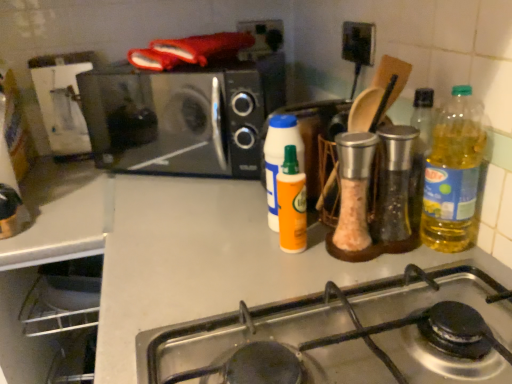
Question: From a real-world perspective, is yellow translucent bottle at right, the 1th bottle from the right, over stainless steel gas stove at lower center?

Choices:
 (A) no
 (B) yes

Answer: (B)

Question: Considering the relative sizes of yellow translucent bottle at right, placed as the fourth bottle when sorted from left to right, and stainless steel gas stove at lower center in the image provided, is yellow translucent bottle at right, placed as the fourth bottle when sorted from left to right, thinner than stainless steel gas stove at lower center?

Choices:
 (A) yes
 (B) no

Answer: (A)

Question: Does yellow translucent bottle at right, the 1th bottle from the right, have a smaller size compared to stainless steel gas stove at lower center?

Choices:
 (A) no
 (B) yes

Answer: (B)

Question: Does yellow translucent bottle at right, placed as the fourth bottle when sorted from left to right, turn towards stainless steel gas stove at lower center?

Choices:
 (A) no
 (B) yes

Answer: (A)

Question: Does yellow translucent bottle at right, the 1th bottle from the right, contain stainless steel gas stove at lower center?

Choices:
 (A) yes
 (B) no

Answer: (B)

Question: From the image's perspective, relative to yellow translucent bottle at right, placed as the fourth bottle when sorted from left to right, is orange matte bottle at center, which appears as the 4th bottle when viewed from the right, above or below?

Choices:
 (A) above
 (B) below

Answer: (A)

Question: Is point (274, 158) positioned closer to the camera than point (464, 107)?

Choices:
 (A) farther
 (B) closer

Answer: (A)

Question: Visually, is orange matte bottle at center, which is the first bottle in left-to-right order, positioned to the left or to the right of yellow translucent bottle at right, placed as the fourth bottle when sorted from left to right?

Choices:
 (A) right
 (B) left

Answer: (B)

Question: Do you think orange matte bottle at center, which appears as the 4th bottle when viewed from the right, is within yellow translucent bottle at right, the 1th bottle from the right, or outside of it?

Choices:
 (A) inside
 (B) outside

Answer: (B)

Question: Do you think yellow translucent bottle at right, the 1th bottle from the right, is within orange matte spray can at center, the 3th bottle when ordered from right to left, or outside of it?

Choices:
 (A) outside
 (B) inside

Answer: (A)

Question: Based on their sizes in the image, would you say yellow translucent bottle at right, placed as the fourth bottle when sorted from left to right, is bigger or smaller than orange matte spray can at center, acting as the second bottle starting from the left?

Choices:
 (A) big
 (B) small

Answer: (A)

Question: Visually, is yellow translucent bottle at right, the 1th bottle from the right, positioned to the left or to the right of orange matte spray can at center, acting as the second bottle starting from the left?

Choices:
 (A) right
 (B) left

Answer: (A)

Question: Considering their positions, is yellow translucent bottle at right, placed as the fourth bottle when sorted from left to right, located in front of or behind orange matte spray can at center, the 3th bottle when ordered from right to left?

Choices:
 (A) front
 (B) behind

Answer: (A)

Question: Looking at their shapes, would you say translucent glass oil at center right, placed as the third bottle when sorted from left to right, is wider or thinner than yellow translucent bottle at right, placed as the fourth bottle when sorted from left to right?

Choices:
 (A) thin
 (B) wide

Answer: (A)

Question: Is translucent glass oil at center right, which ranks as the 2th bottle in right-to-left order, situated inside yellow translucent bottle at right, the 1th bottle from the right, or outside?

Choices:
 (A) inside
 (B) outside

Answer: (B)